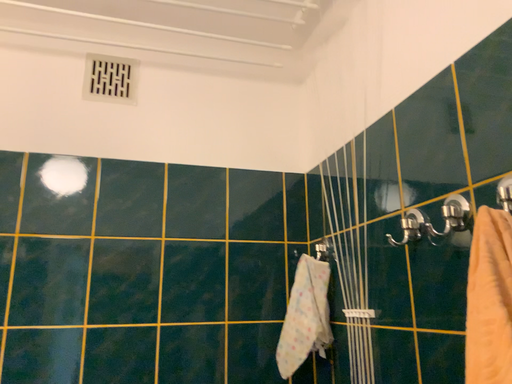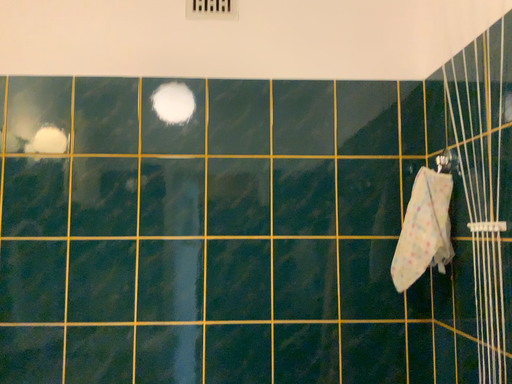
Question: How did the camera likely rotate when shooting the video?

Choices:
 (A) rotated upward
 (B) rotated downward

Answer: (B)